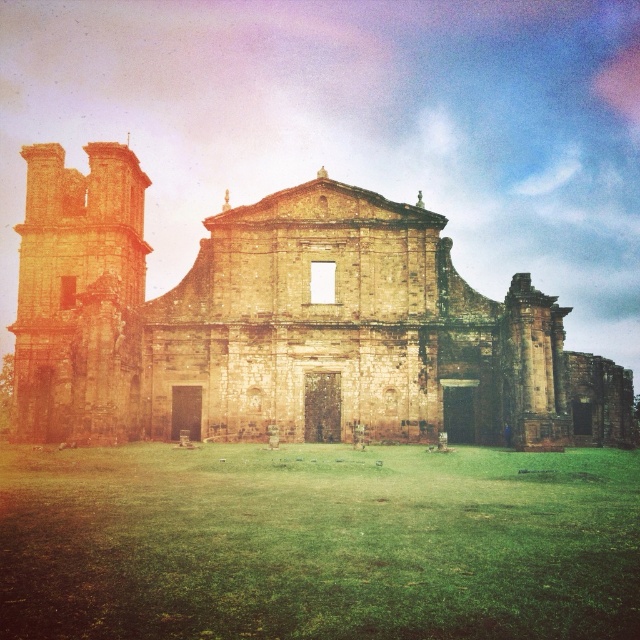
Can you confirm if brown stone church at center is thinner than green grass at center?

In fact, brown stone church at center might be wider than green grass at center.

The image size is (640, 640). I want to click on brown stone church at center, so click(x=282, y=324).

Is point (230, 230) more distant than point (339, 477)?

Yes, point (230, 230) is farther from viewer.

The image size is (640, 640). What are the coordinates of `brown stone church at center` in the screenshot? It's located at (282, 324).